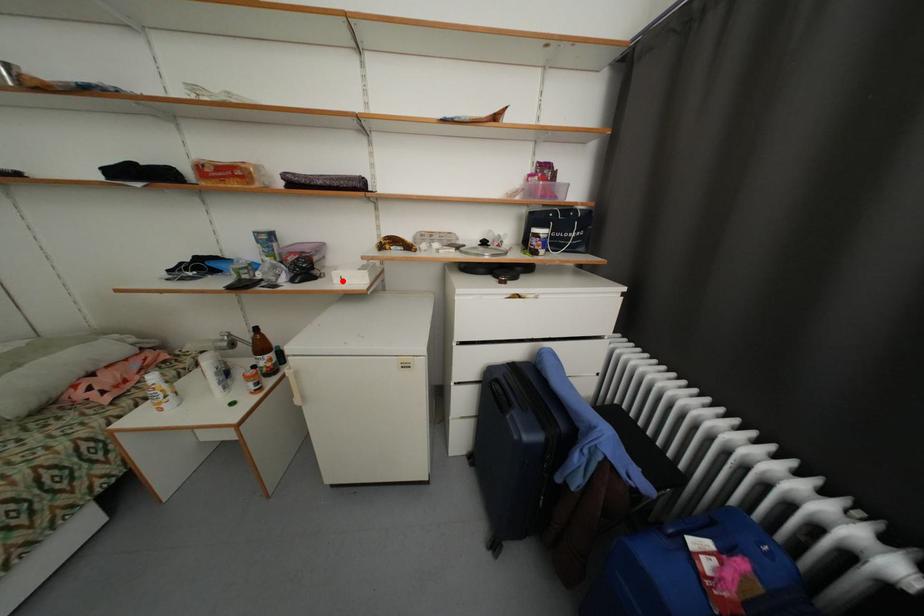
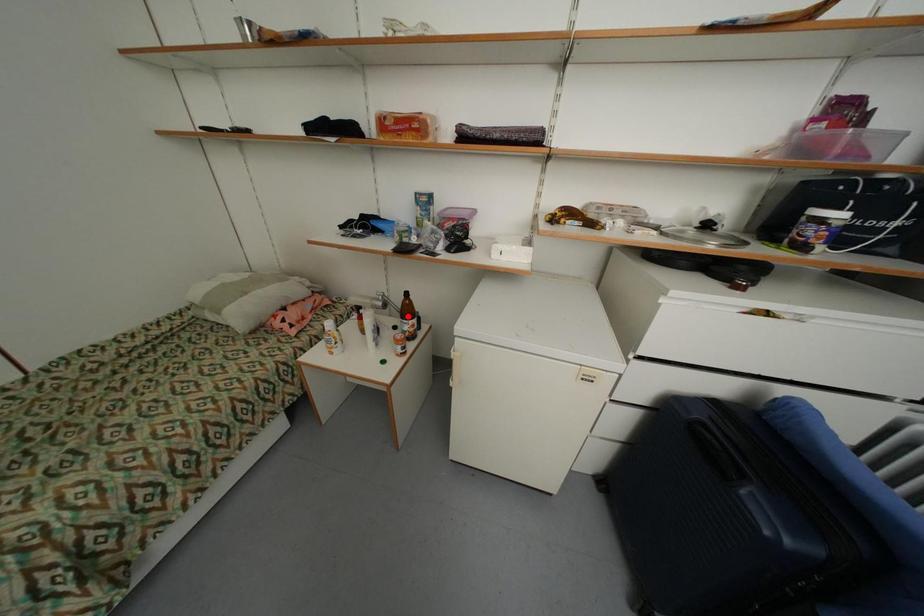
I am providing you with two images of the same scene from different viewpoints. A red point is marked on the first image and another point is marked on the second image. Is the marked point in image1 the same physical position as the marked point in image2?

No